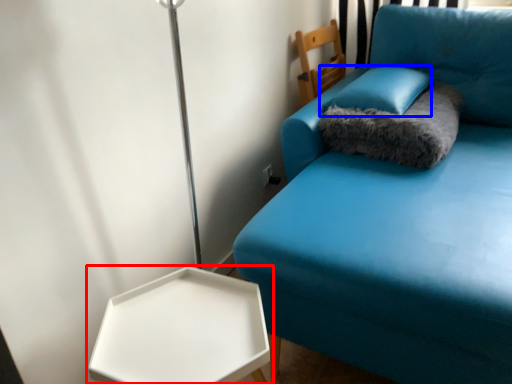
Question: Which object is further to the camera taking this photo, table (highlighted by a red box) or pillow (highlighted by a blue box)?

Choices:
 (A) table
 (B) pillow

Answer: (B)